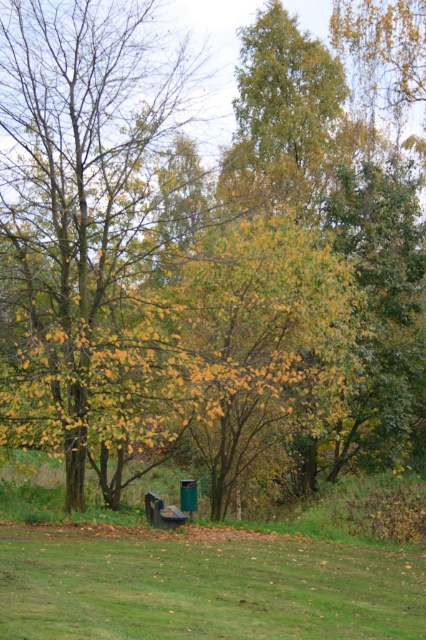
You are standing at the point marked by the coordinates point (279, 115) in the image. Looking around, you see a green leafy tree at upper center. What is the nearest object to you?

The nearest object to you is the green leafy tree at upper center since it is marked by the coordinates point (279, 115), which indicates its location.

You are planning to set up a picnic blanket in the green grassy field at lower center. Considering the size of the wooden park bench at center, will there be enough space to place a picnic blanket that is 2 meters by 2 meters?

Result: The green grassy field at lower center is larger in size than the wooden park bench at center, so there should be sufficient space to place a 2m by 2m picnic blanket.